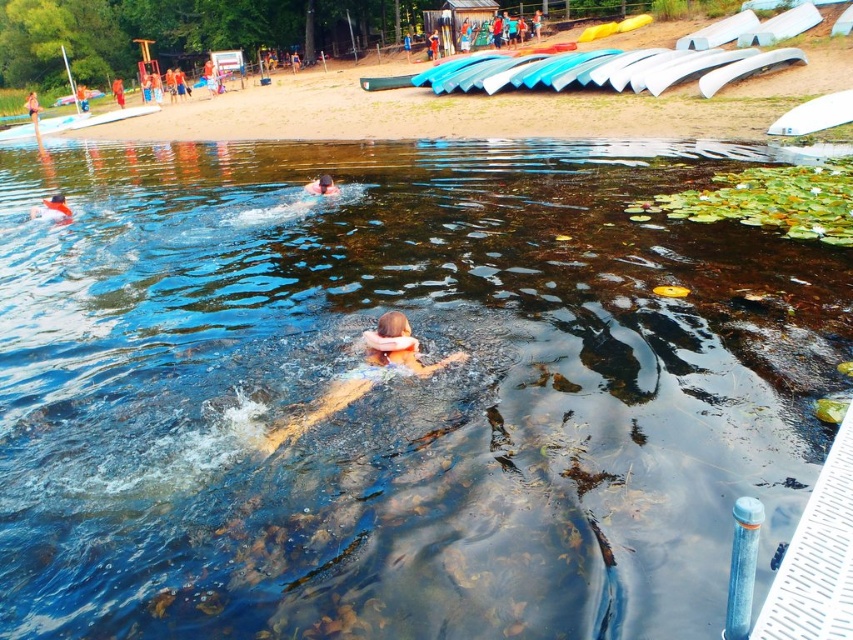
Based on the photo, you are a lifeguard on duty and notice two objects in the water. You see the matte orange swim cap at lower center and the pink foam at center. Which object is positioned more to the left side of the scene?

The matte orange swim cap at lower center is positioned more to the left side of the scene compared to the pink foam at center.